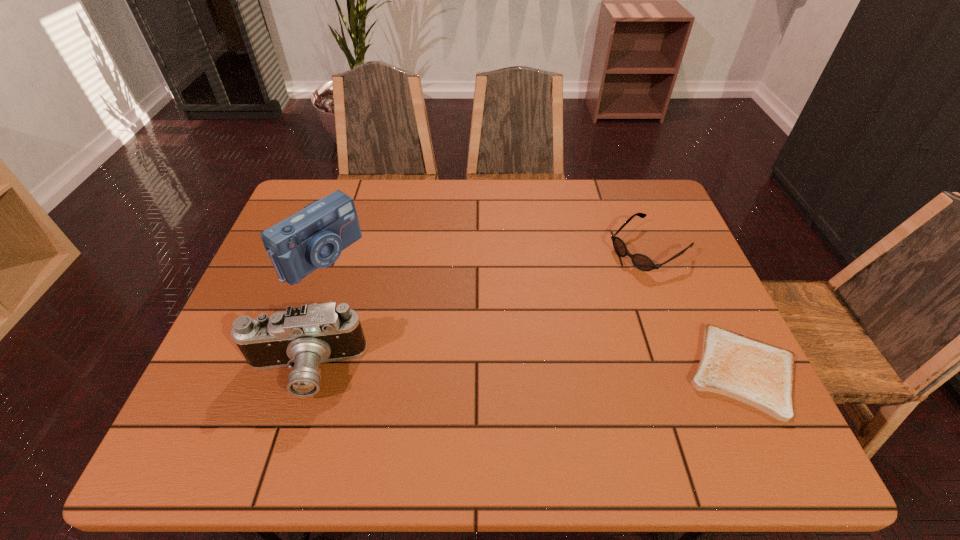
The image size is (960, 540). Find the location of `vacant space on the desktop that is between the nearer camera and the shortest object and is positioned on the lens of the farther camera`. vacant space on the desktop that is between the nearer camera and the shortest object and is positioned on the lens of the farther camera is located at coordinates (485, 370).

Identify the location of free space on the desktop that is between the nearer camera and the toast and is positioned on the lenses of the sunglasses. The width and height of the screenshot is (960, 540). (465, 370).